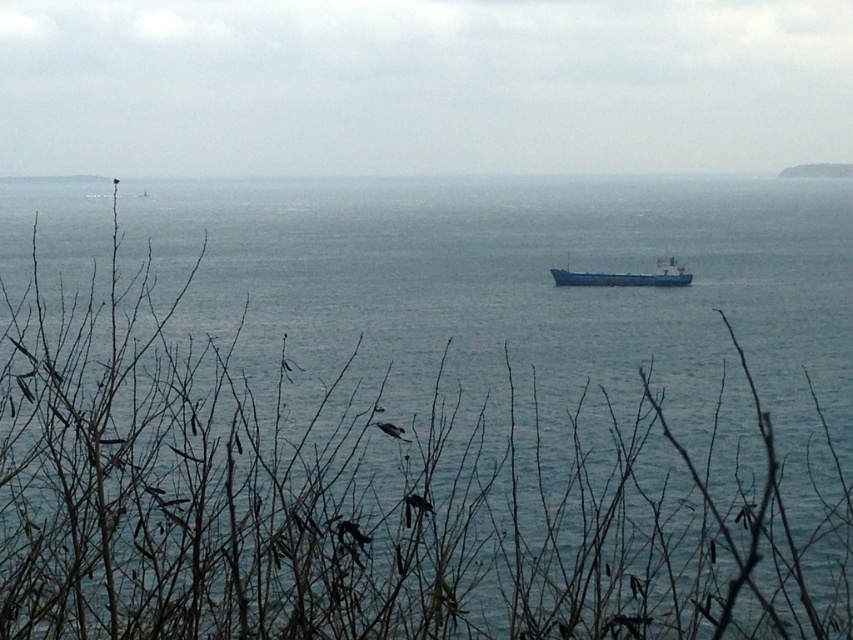
Question: Is blue matte water at center bigger than blue matte cargo ship at center?

Choices:
 (A) no
 (B) yes

Answer: (B)

Question: Which object is closer to the camera taking this photo?

Choices:
 (A) blue matte cargo ship at center
 (B) blue matte water at center

Answer: (B)

Question: Where is blue matte water at center located in relation to blue matte cargo ship at center in the image?

Choices:
 (A) left
 (B) right

Answer: (A)

Question: Which point appears farthest from the camera in this image?

Choices:
 (A) (619, 540)
 (B) (672, 269)

Answer: (B)

Question: Can you confirm if blue matte water at center is positioned above blue matte cargo ship at center?

Choices:
 (A) no
 (B) yes

Answer: (B)